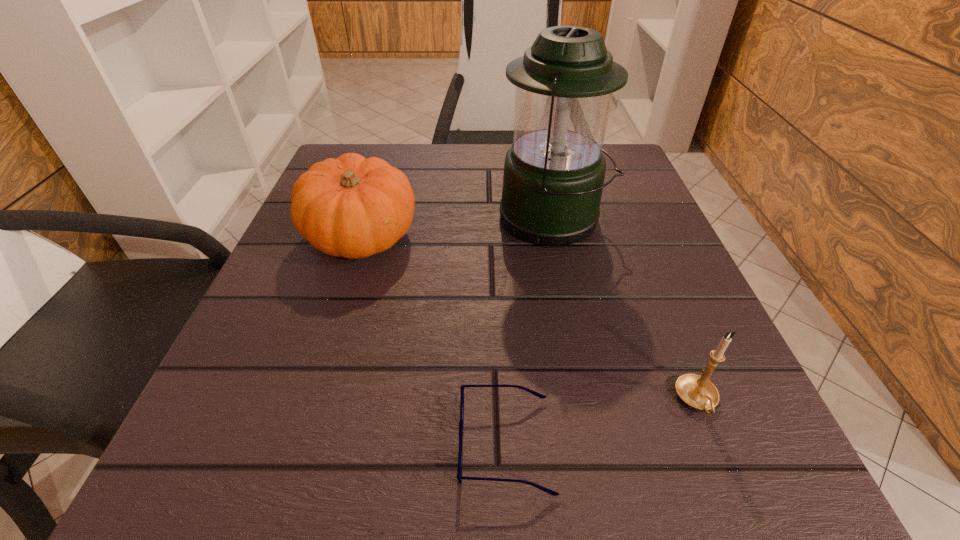
At what (x,y) coordinates should I click in order to perform the action: click on free region at the far left corner. Please return your answer as a coordinate pair (x, y). Looking at the image, I should click on (356, 150).

In the image, there is a desktop. What are the coordinates of `vacant region at the near left corner` in the screenshot? It's located at (293, 440).

In the image, there is a desktop. Where is `free region at the far right corner`? This screenshot has width=960, height=540. free region at the far right corner is located at coordinates (627, 154).

The image size is (960, 540). Find the location of `vacant area that lies between the rightmost object and the spectacles`. vacant area that lies between the rightmost object and the spectacles is located at coordinates (601, 422).

This screenshot has width=960, height=540. In order to click on empty space that is in between the tallest object and the shortest object in this screenshot , I will do `click(530, 332)`.

This screenshot has width=960, height=540. Identify the location of free space between the spectacles and the leftmost object. (433, 340).

This screenshot has height=540, width=960. What are the coordinates of `free space that is in between the spectacles and the leftmost object` in the screenshot? It's located at (433, 340).

This screenshot has width=960, height=540. Identify the location of unoccupied area between the rightmost object and the pumpkin. (529, 319).

Identify the location of vacant region between the rightmost object and the leftmost object. This screenshot has height=540, width=960. (529, 319).

Locate an element on the screen. free spot between the shortest object and the leftmost object is located at coordinates (433, 340).